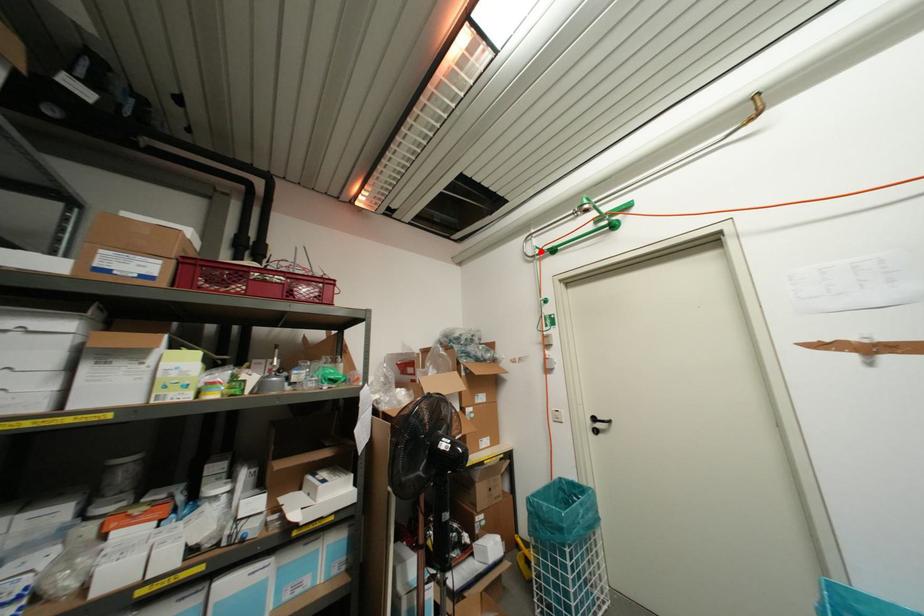
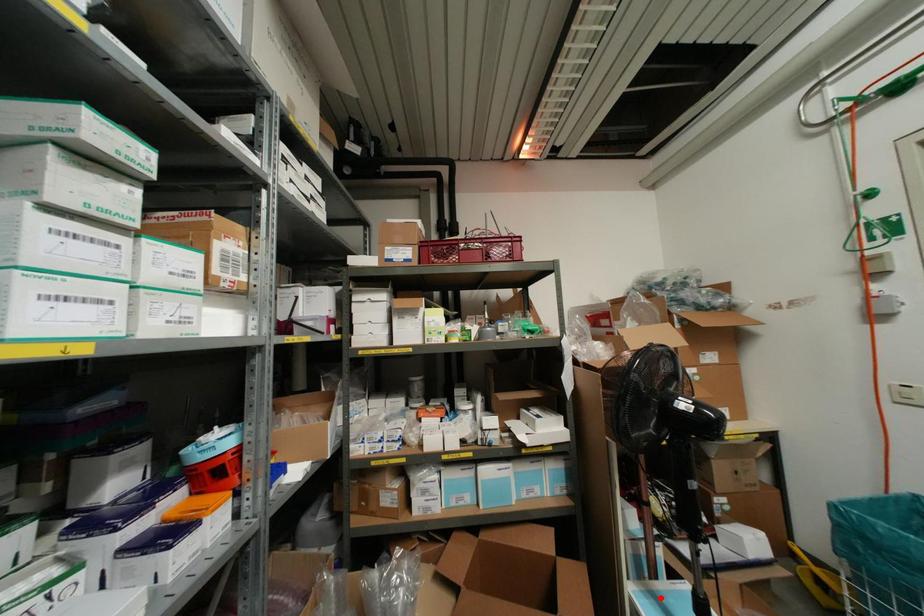
I am providing you with two images of the same scene from different viewpoints. A red point is marked on the first image and another point is marked on the second image. Do the highlighted points in image1 and image2 indicate the same real-world spot?

No